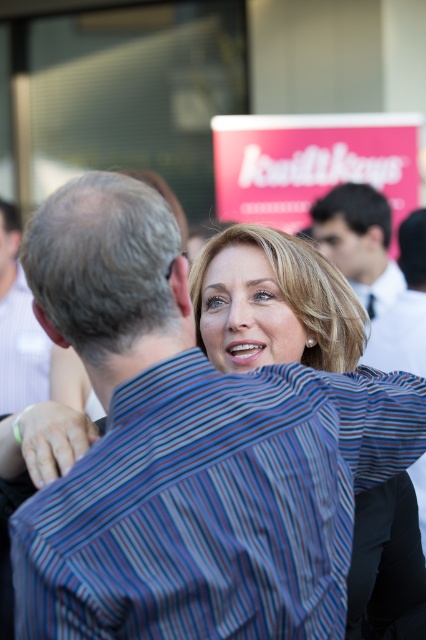
Question: Is striped cotton shirt at center closer to camera compared to dark blue shirt at upper right?

Choices:
 (A) no
 (B) yes

Answer: (B)

Question: Which object is the farthest from the striped shirt at left?

Choices:
 (A) white striped shirt at center
 (B) striped shirt at center

Answer: (A)

Question: Which point appears farthest from the camera in this image?

Choices:
 (A) (340, 198)
 (B) (2, 236)
 (C) (264, 408)

Answer: (B)

Question: Considering the relative positions of striped shirt at center and dark blue shirt at upper right in the image provided, where is striped shirt at center located with respect to dark blue shirt at upper right?

Choices:
 (A) below
 (B) above

Answer: (A)

Question: Does striped cotton shirt at center have a lesser width compared to white striped shirt at center?

Choices:
 (A) no
 (B) yes

Answer: (A)

Question: Based on their relative distances, which object is nearer to the dark blue shirt at upper right?

Choices:
 (A) striped cotton shirt at center
 (B) white striped shirt at center
 (C) striped shirt at left

Answer: (B)